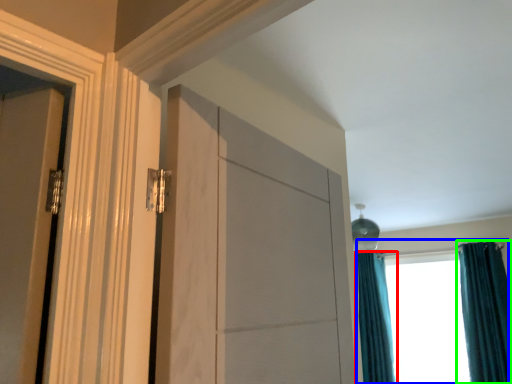
Question: Based on their relative distances, which object is nearer to curtain (highlighted by a red box)? Choose from window (highlighted by a blue box) and curtain (highlighted by a green box).

Choices:
 (A) window
 (B) curtain

Answer: (A)